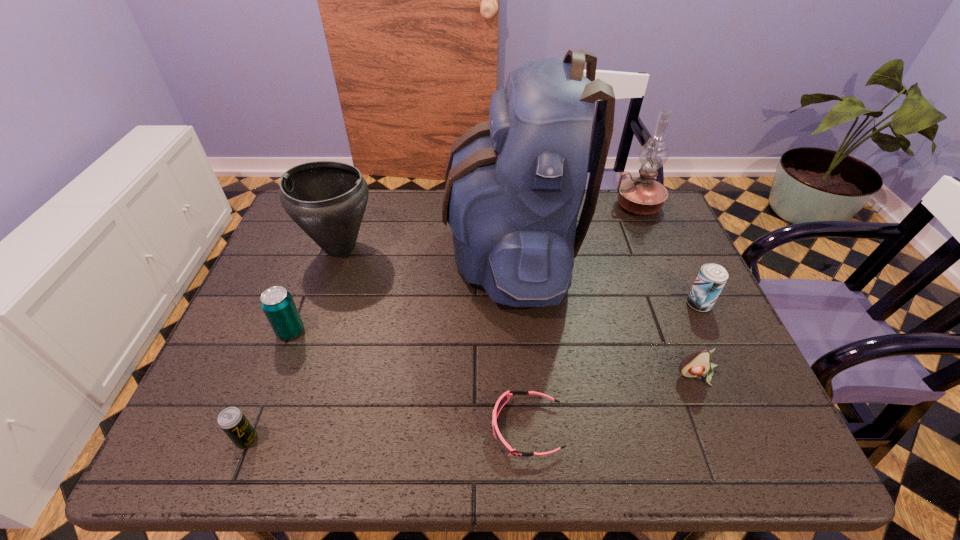
You are a GUI agent. You are given a task and a screenshot of the screen. Output one action in this format:
    pyautogui.click(x=<x>, y=<y>)
    Task: Click on the free location that satisfies the following two spatial constraints: 1. on the back side of the sixth shortest object; 2. on the left side of the second farthest beer can
    
    Given the screenshot: What is the action you would take?
    pyautogui.click(x=323, y=247)

You are a GUI agent. You are given a task and a screenshot of the screen. Output one action in this format:
    pyautogui.click(x=<x>, y=<y>)
    Task: Click on the free space that satisfies the following two spatial constraints: 1. on the seed side of the third nearest object; 2. on the front-facing side of the goggles
    The width and height of the screenshot is (960, 540).
    Given the screenshot: What is the action you would take?
    pyautogui.click(x=718, y=428)

This screenshot has width=960, height=540. In order to click on vacant region that satisfies the following two spatial constraints: 1. on the back side of the rightmost beer can; 2. on the right side of the second farthest beer can in this screenshot , I will do `click(300, 304)`.